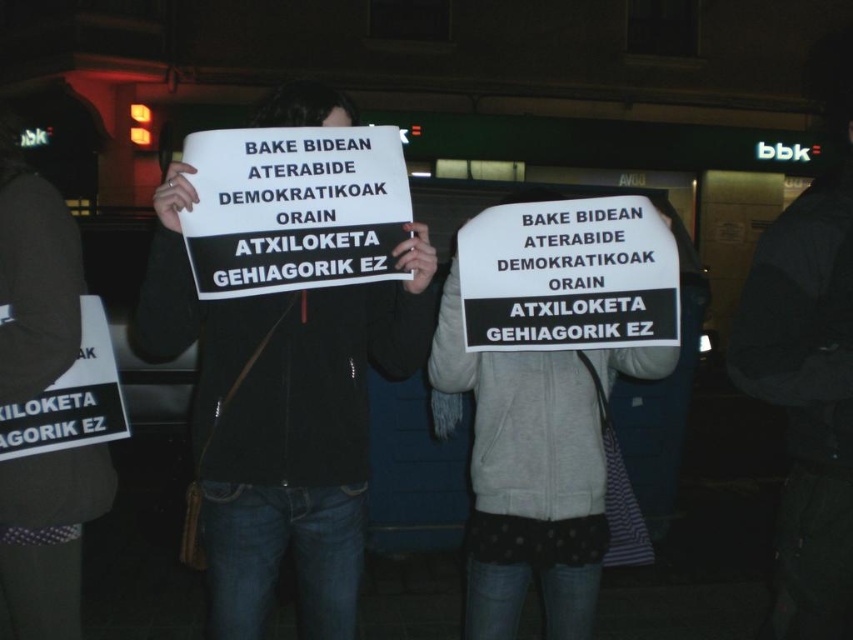
Is white fabric sign at center bigger than white paper sign at center?

Correct, white fabric sign at center is larger in size than white paper sign at center.

The height and width of the screenshot is (640, 853). Find the location of `white fabric sign at center`. white fabric sign at center is located at coordinates (532, 472).

What do you see at coordinates (281, 419) in the screenshot?
I see `black matte sign at center` at bounding box center [281, 419].

Between black matte sign at center and white fabric sign at center, which one is positioned lower?

white fabric sign at center is lower down.

Is point (305, 522) more distant than point (572, 620)?

No, (305, 522) is in front of (572, 620).

Locate an element on the screen. This screenshot has height=640, width=853. black matte sign at center is located at coordinates (281, 419).

Can you confirm if black matte sign at center is positioned to the right of white paper sign at center?

In fact, black matte sign at center is to the left of white paper sign at center.

Does black matte sign at center have a smaller size compared to white paper sign at center?

Incorrect, black matte sign at center is not smaller in size than white paper sign at center.

Locate an element on the screen. black matte sign at center is located at coordinates (281, 419).